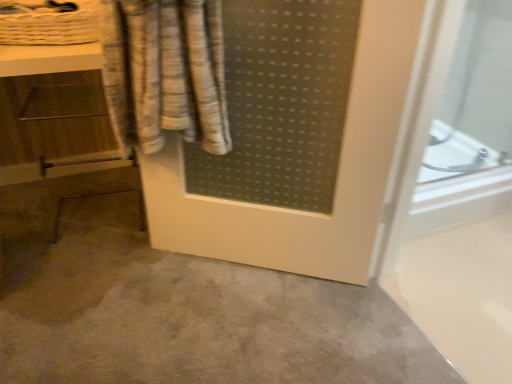
Question: Based on their sizes in the image, would you say gray matte concrete at center is bigger or smaller than white woven basket at upper left?

Choices:
 (A) big
 (B) small

Answer: (A)

Question: Relative to white woven basket at upper left, is gray matte concrete at center in front or behind?

Choices:
 (A) front
 (B) behind

Answer: (A)

Question: Estimate the real-world distances between objects in this image. Which object is closer to the wooden vanity at left?

Choices:
 (A) white woven basket at upper left
 (B) gray matte concrete at center

Answer: (A)

Question: Which is farther from the wooden vanity at left?

Choices:
 (A) white woven basket at upper left
 (B) gray matte concrete at center

Answer: (B)